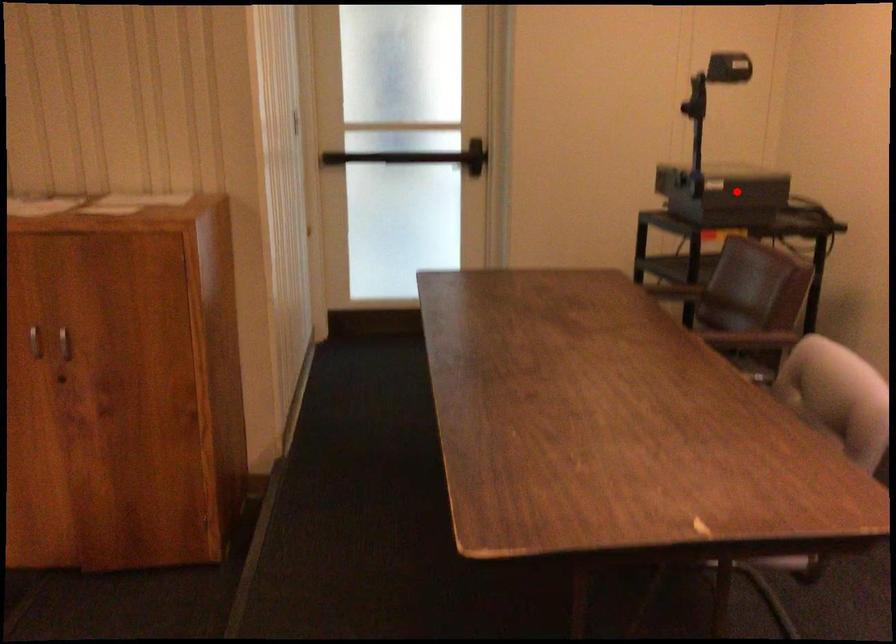
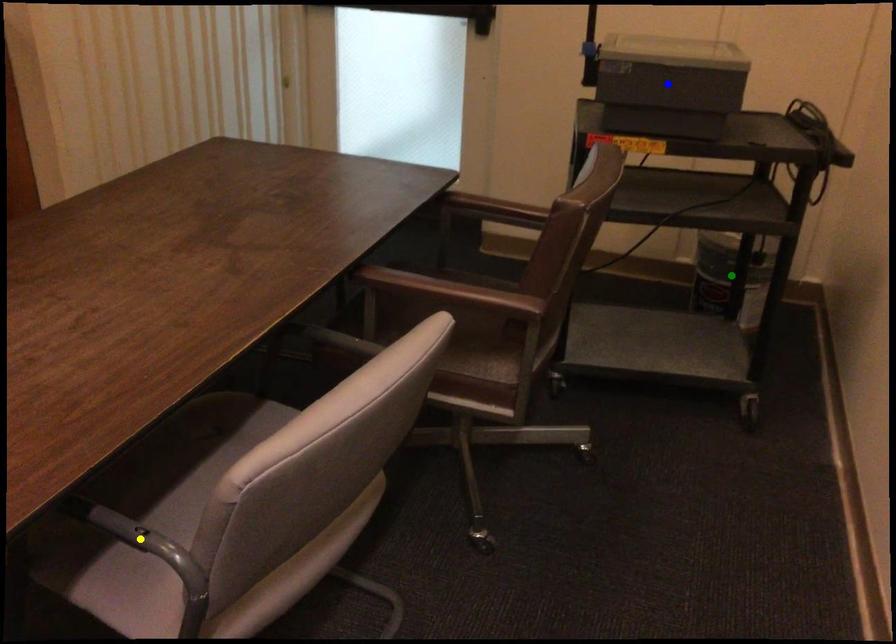
Question: I am providing you with two images of the same scene from different viewpoints. A red point is marked on the first image. You are given multiple points on the second image. Which point in image 2 is actually the same real-world point as the red point in image 1?

Choices:
 (A) green point
 (B) blue point
 (C) yellow point

Answer: (B)